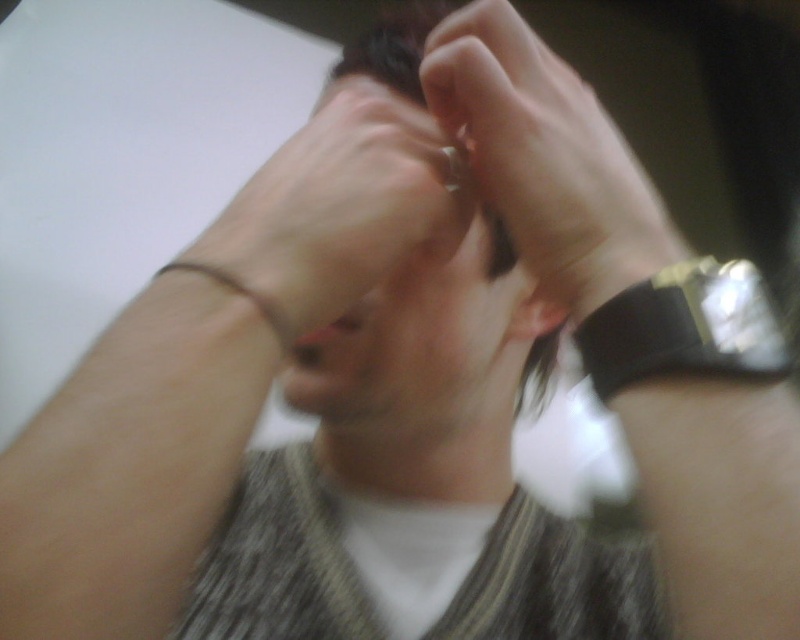
Which is in front, point (662, 266) or point (229, 289)?

Point (229, 289) is in front.

Does slightly translucent skin at center have a greater height compared to brown leather bracelet at left?

Yes, slightly translucent skin at center is taller than brown leather bracelet at left.

Which is behind, point (621, 189) or point (277, 340)?

Positioned behind is point (621, 189).

You are a GUI agent. You are given a task and a screenshot of the screen. Output one action in this format:
    pyautogui.click(x=<x>, y=<y>)
    Task: Click on the slightly translucent skin at center
    Image resolution: width=800 pixels, height=640 pixels.
    Given the screenshot: What is the action you would take?
    pyautogui.click(x=546, y=156)

Is black rubber wristband at right below dark brown hair at center?

Correct, black rubber wristband at right is located below dark brown hair at center.

Locate an element on the screen. The height and width of the screenshot is (640, 800). black rubber wristband at right is located at coordinates (686, 328).

The width and height of the screenshot is (800, 640). I want to click on black rubber wristband at right, so click(x=686, y=328).

Locate an element on the screen. This screenshot has width=800, height=640. black rubber wristband at right is located at coordinates [x=686, y=328].

Is slightly translucent skin at center shorter than dark brown hair at center?

Indeed, slightly translucent skin at center has a lesser height compared to dark brown hair at center.

Is slightly translucent skin at center to the left of dark brown hair at center from the viewer's perspective?

Correct, you'll find slightly translucent skin at center to the left of dark brown hair at center.

Is point (594, 292) less distant than point (404, 26)?

Yes.

At what (x,y) coordinates should I click in order to perform the action: click on slightly translucent skin at center. Please return your answer as a coordinate pair (x, y). This screenshot has width=800, height=640. Looking at the image, I should click on (546, 156).